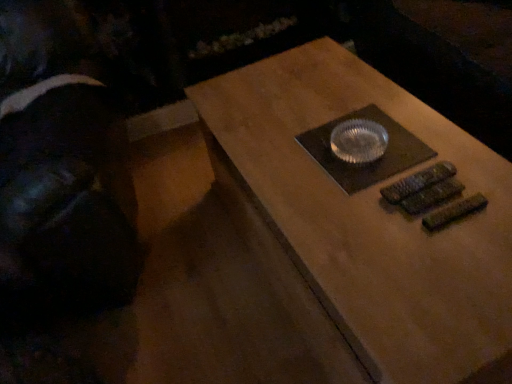
What do you see at coordinates (59, 170) in the screenshot? I see `black fabric at left` at bounding box center [59, 170].

What is the approximate height of black fabric at left?

36.03 inches.

Find the location of a particular element. black fabric at left is located at coordinates (59, 170).

You are a GUI agent. You are given a task and a screenshot of the screen. Output one action in this format:
    pyautogui.click(x=<x>, y=<y>)
    Task: Click on the matte brown table at center
    The image size is (512, 384).
    Given the screenshot: What is the action you would take?
    pyautogui.click(x=373, y=215)

What do you see at coordinates (373, 215) in the screenshot?
I see `matte brown table at center` at bounding box center [373, 215].

The width and height of the screenshot is (512, 384). In order to click on black fabric at left in this screenshot , I will do [x=59, y=170].

Which object is positioned more to the right, matte brown table at center or black fabric at left?

From the viewer's perspective, matte brown table at center appears more on the right side.

Considering their positions, is matte brown table at center located in front of or behind black fabric at left?

Clearly, matte brown table at center is in front of black fabric at left.

Between point (256, 141) and point (2, 237), which one is positioned behind?

The point (256, 141) is farther.

From the image's perspective, does matte brown table at center appear lower than black fabric at left?

Yes.

From a real-world perspective, is matte brown table at center over black fabric at left?

No, from a real-world perspective, matte brown table at center is not on top of black fabric at left.

Which of these two, matte brown table at center or black fabric at left, is wider?

With larger width is matte brown table at center.

Does matte brown table at center have a lesser height compared to black fabric at left?

Indeed, matte brown table at center has a lesser height compared to black fabric at left.

Can you confirm if matte brown table at center is smaller than black fabric at left?

Yes.

Is matte brown table at center positioned beyond the bounds of black fabric at left?

matte brown table at center lies outside black fabric at left's area.

Is matte brown table at center next to black fabric at left and touching it?

No, matte brown table at center is not making contact with black fabric at left.

Does matte brown table at center turn towards black fabric at left?

No, matte brown table at center is not facing towards black fabric at left.

In the scene shown: How many degrees apart are the facing directions of matte brown table at center and black fabric at left?

They differ by 12.9 degrees in their facing directions.

At what (x,y) coordinates should I click in order to perform the action: click on table in front of the black fabric at left. Please return your answer as a coordinate pair (x, y). This screenshot has height=384, width=512. Looking at the image, I should click on (373, 215).

Which object is positioned more to the right, black fabric at left or matte brown table at center?

Positioned to the right is matte brown table at center.

Which object is closer to the camera, black fabric at left or matte brown table at center?

matte brown table at center is closer to the camera.

Between point (82, 264) and point (426, 300), which one is positioned behind?

The point (82, 264) is farther from the camera.

From the image's perspective, which is above, black fabric at left or matte brown table at center?

From the image's view, black fabric at left is above.

From a real-world perspective, relative to matte brown table at center, is black fabric at left vertically above or below?

In terms of real-world spatial position, black fabric at left is above matte brown table at center.

Is black fabric at left thinner than matte brown table at center?

Correct, the width of black fabric at left is less than that of matte brown table at center.

Does black fabric at left have a greater height compared to matte brown table at center?

Yes.

Is black fabric at left bigger than matte brown table at center?

Indeed, black fabric at left has a larger size compared to matte brown table at center.

Is black fabric at left positioned beyond the bounds of matte brown table at center?

Yes, black fabric at left is not within matte brown table at center.

Is black fabric at left far away from matte brown table at center?

No, black fabric at left is not far from matte brown table at center.

Is black fabric at left turned away from matte brown table at center?

No, black fabric at left's orientation is not away from matte brown table at center.

I want to click on table on the right of black fabric at left, so tap(373, 215).

Locate an element on the screen. The width and height of the screenshot is (512, 384). person located above the matte brown table at center (from a real-world perspective) is located at coordinates (59, 170).

Where is `person above the matte brown table at center (from the image's perspective)`? This screenshot has width=512, height=384. person above the matte brown table at center (from the image's perspective) is located at coordinates (59, 170).